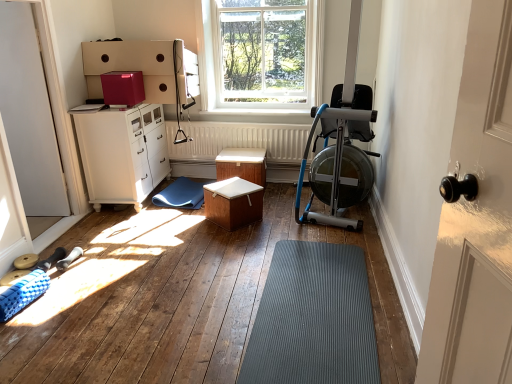
Question: Choose the correct answer: Is white matte radiator at center inside blue metallic rowing machine at right or outside it?

Choices:
 (A) inside
 (B) outside

Answer: (B)

Question: Considering the relative positions of white matte radiator at center and blue metallic rowing machine at right in the image provided, is white matte radiator at center to the left or to the right of blue metallic rowing machine at right?

Choices:
 (A) left
 (B) right

Answer: (A)

Question: Which object is the farthest from the white matte radiator at center?

Choices:
 (A) white glossy cabinet at left
 (B) clear glass window at upper center
 (C) blue metallic rowing machine at right
 (D) wooden table at center, which ranks as the first table in back-to-front order
 (E) white matte wooden box at center, the second table positioned from the back

Answer: (B)

Question: Which is farther from the blue metallic rowing machine at right?

Choices:
 (A) blue rubber mat at lower left
 (B) gray rubber mat at center
 (C) white glossy cabinet at left
 (D) clear glass window at upper center
 (E) white matte door at left

Answer: (E)